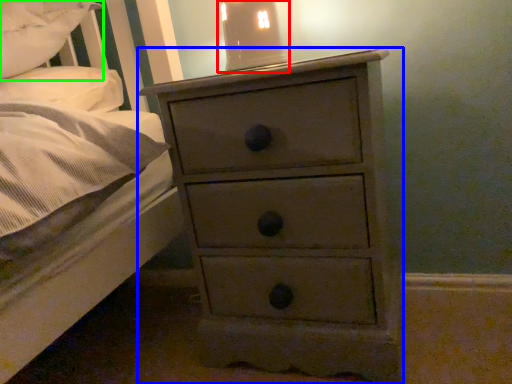
Question: Estimate the real-world distances between objects in this image. Which object is closer to bedside lamp (highlighted by a red box), chest of drawers (highlighted by a blue box) or pillow (highlighted by a green box)?

Choices:
 (A) chest of drawers
 (B) pillow

Answer: (A)